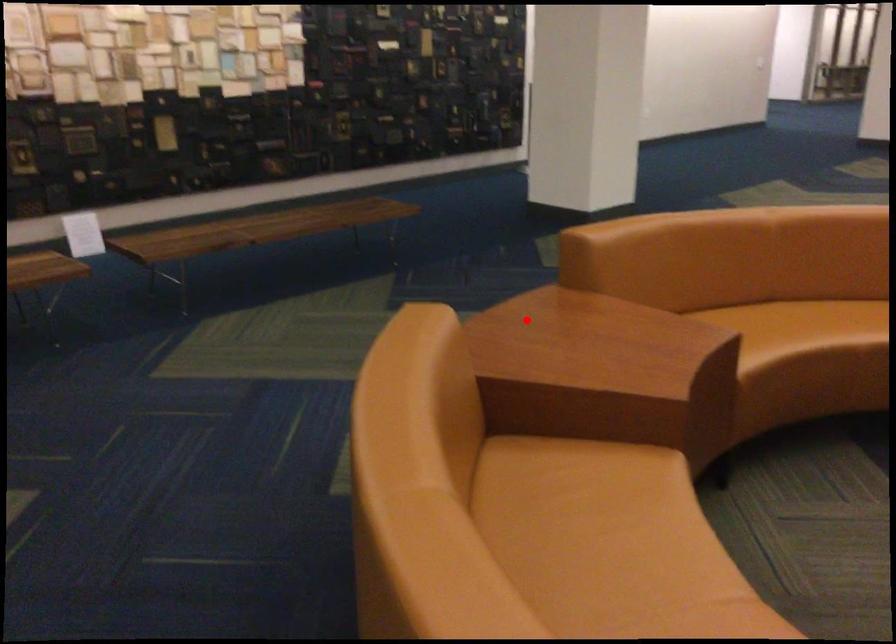
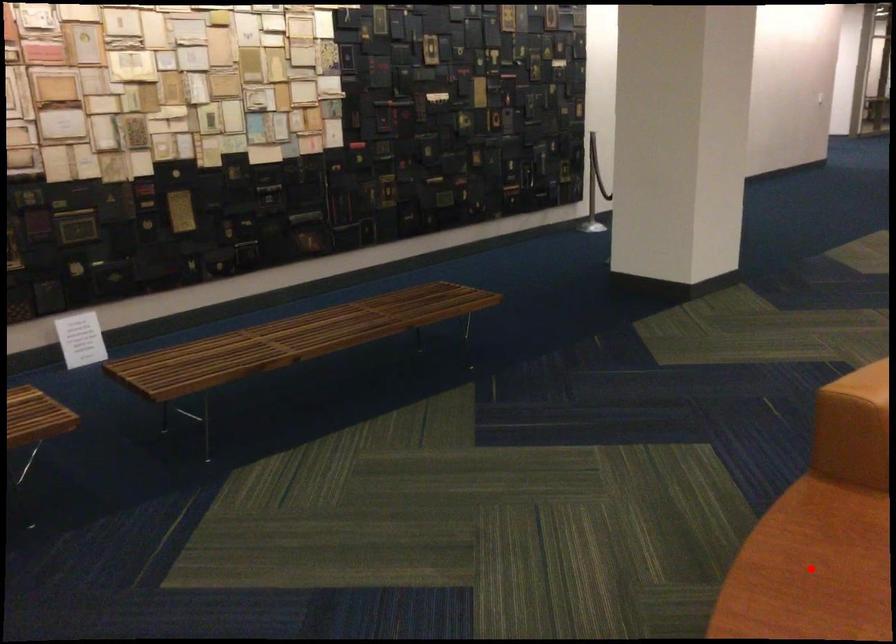
I am providing you with two images of the same scene from different viewpoints. A red point is marked on the first image and another point is marked on the second image. Is the red point in image1 aligned with the point shown in image2?

Yes